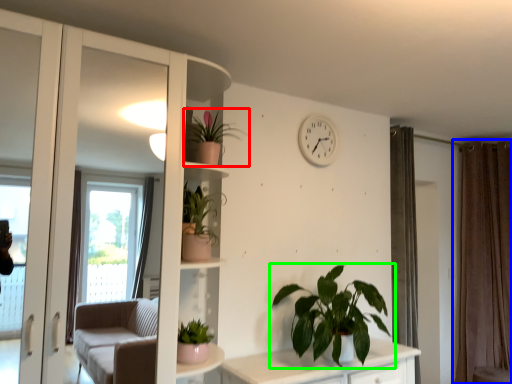
Question: Which object is positioned farthest from houseplant (highlighted by a red box)? Select from curtain (highlighted by a blue box) and houseplant (highlighted by a green box).

Choices:
 (A) curtain
 (B) houseplant

Answer: (A)